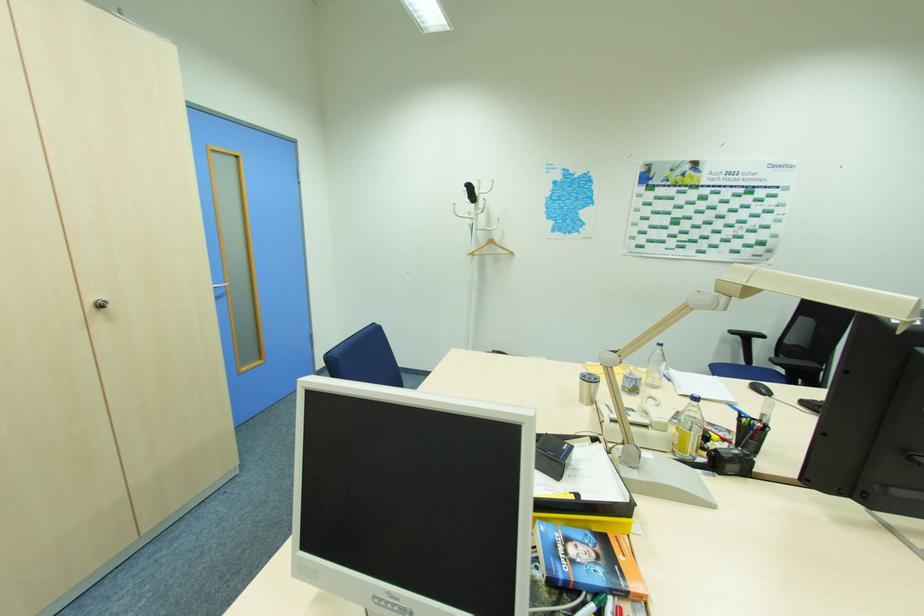
The location [655,367] corresponds to which object?

This point indicates the clear water bottle.